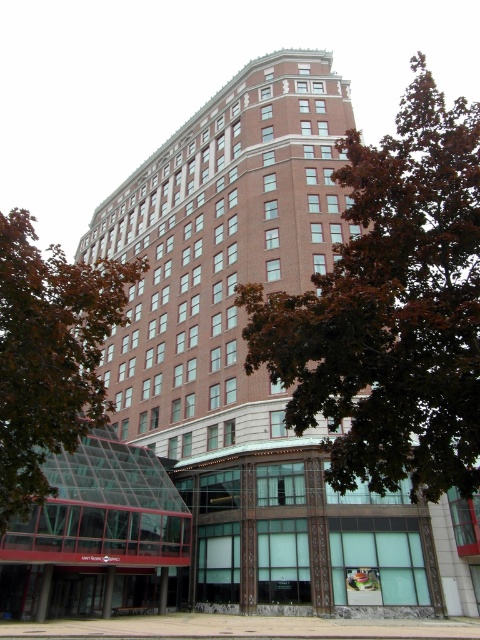
You are standing at the entrance of the building and looking up. There is a point marked at coordinates (391, 308). What object is located at this point?

The point at coordinates (391, 308) is occupied by the brown leafy tree at upper center.

You are standing in front of the building and notice two trees. One is the brown leafy tree at upper center and the other is the green leafy tree at lower left. Which tree appears taller from your viewing position?

The brown leafy tree at upper center appears taller than the green leafy tree at lower left from your viewing position.